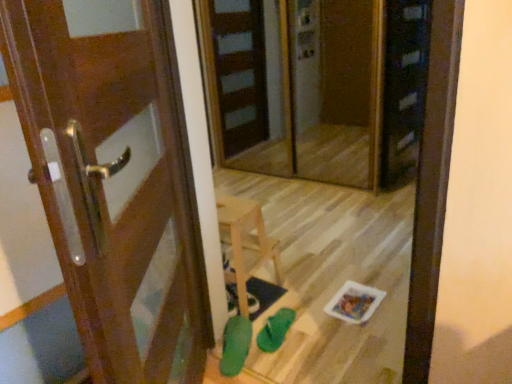
I want to click on spots to the right of green rubber shoe at lower center, arranged as the first shoe when viewed from the left, so click(x=280, y=356).